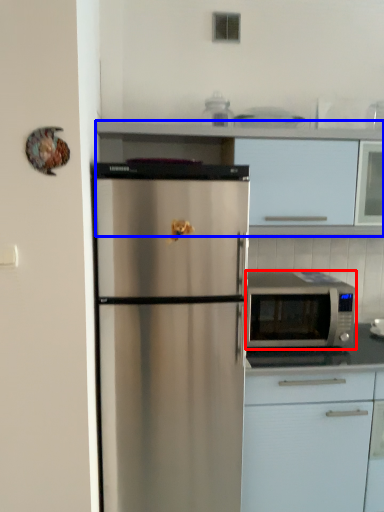
Question: Which of the following is the closest to the observer, microwave oven (highlighted by a red box) or cabinetry (highlighted by a blue box)?

Choices:
 (A) microwave oven
 (B) cabinetry

Answer: (B)